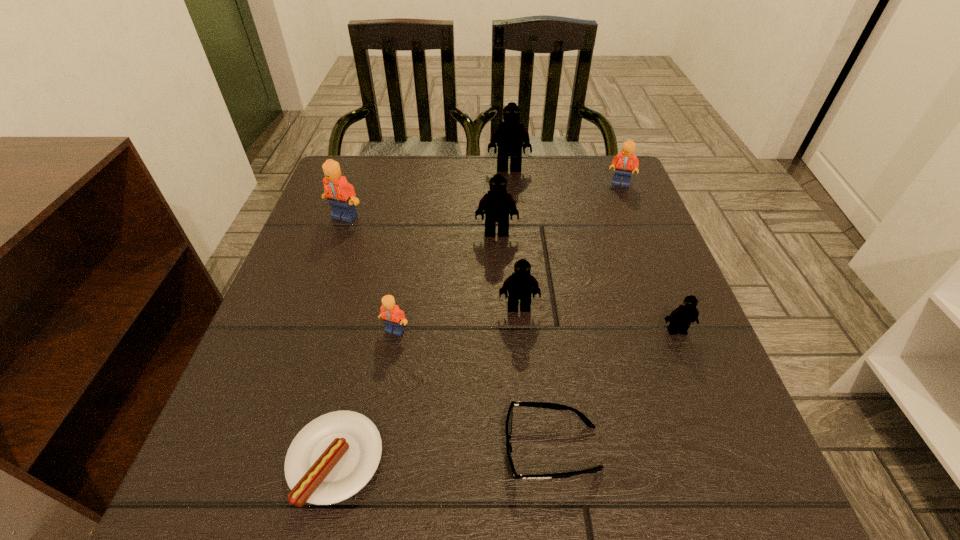
I want to click on the second orange Lego from right to left, so click(393, 317).

Where is `the nearest orange Lego`? the nearest orange Lego is located at coordinates (393, 317).

Locate an element on the screen. This screenshot has width=960, height=540. the nearest black Lego is located at coordinates (680, 318).

Find the location of a particular element. This screenshot has width=960, height=540. the rightmost black Lego is located at coordinates (680, 318).

The height and width of the screenshot is (540, 960). What are the coordinates of `sunglasses` in the screenshot? It's located at (508, 426).

Where is `sausage`? sausage is located at coordinates (333, 457).

Where is `vacant area situated 0.380m on the face of the biggest black Lego`? The height and width of the screenshot is (540, 960). vacant area situated 0.380m on the face of the biggest black Lego is located at coordinates (517, 271).

The image size is (960, 540). What are the coordinates of `blank space located on the front-facing side of the third farthest Lego` in the screenshot? It's located at (304, 332).

The image size is (960, 540). What are the coordinates of `free spot located 0.230m on the face of the second biggest black Lego` in the screenshot? It's located at (500, 316).

Identify the location of vacant space located 0.340m on the front-facing side of the farthest orange Lego. The image size is (960, 540). (660, 281).